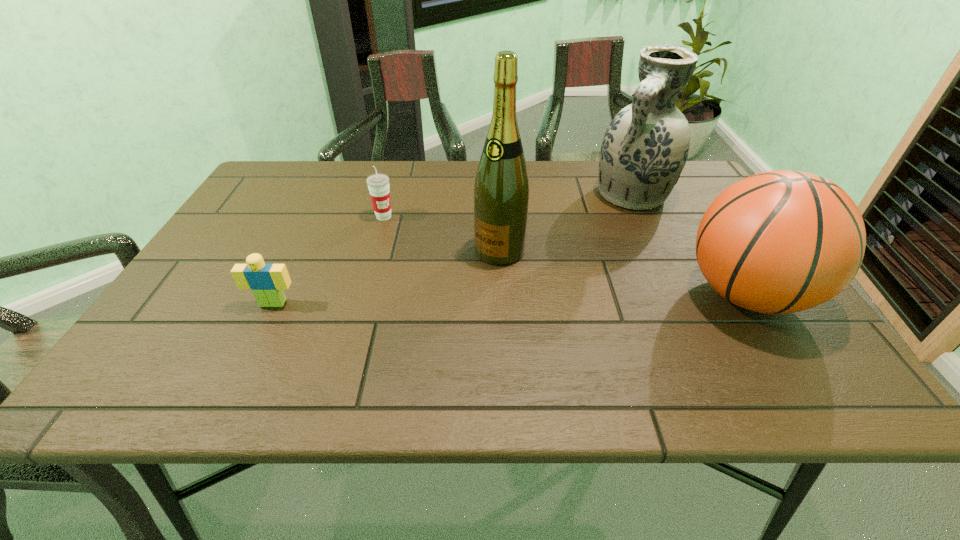
Identify the location of blank area in the image that satisfies the following two spatial constraints: 1. on the front side of the wine bottle; 2. on the right side of the basketball. (502, 295).